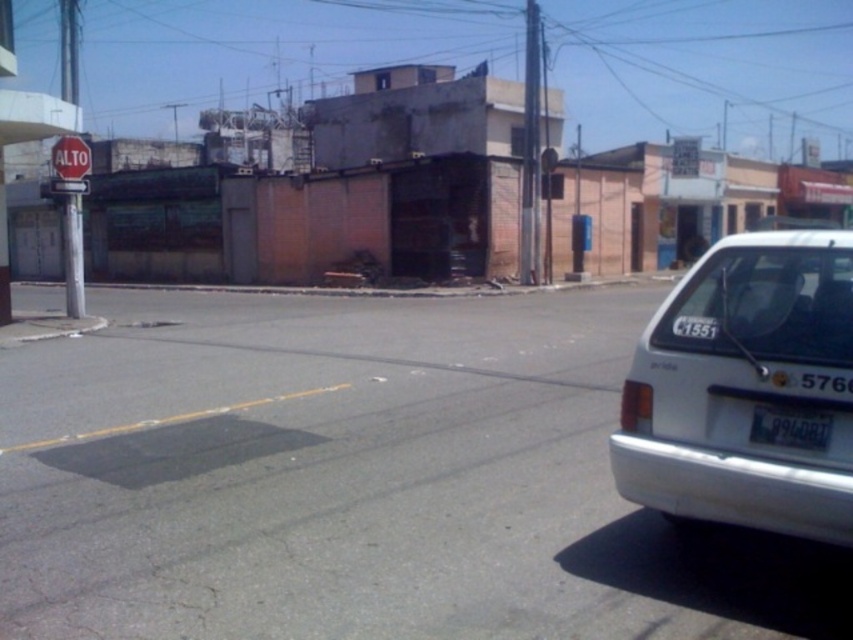
Question: Which object appears closest to the camera in this image?

Choices:
 (A) black plastic license plate at lower right
 (B) white plastic sign at upper left
 (C) white matte sedan at right
 (D) red matte stop sign at upper left

Answer: (C)

Question: Which point is closer to the camera?

Choices:
 (A) white matte sedan at right
 (B) black plastic license plate at lower right
 (C) white plastic sign at upper left

Answer: (A)

Question: Is white matte sedan at right bigger than red matte stop sign at upper left?

Choices:
 (A) yes
 (B) no

Answer: (A)

Question: Which of the following is the farthest from the observer?

Choices:
 (A) white plastic sign at upper left
 (B) white matte sedan at right
 (C) red matte stop sign at upper left

Answer: (A)

Question: Does red matte stop sign at upper left appear over white plastic sign at upper left?

Choices:
 (A) yes
 (B) no

Answer: (B)

Question: Does white matte sedan at right lie in front of white plastic sign at upper left?

Choices:
 (A) no
 (B) yes

Answer: (B)